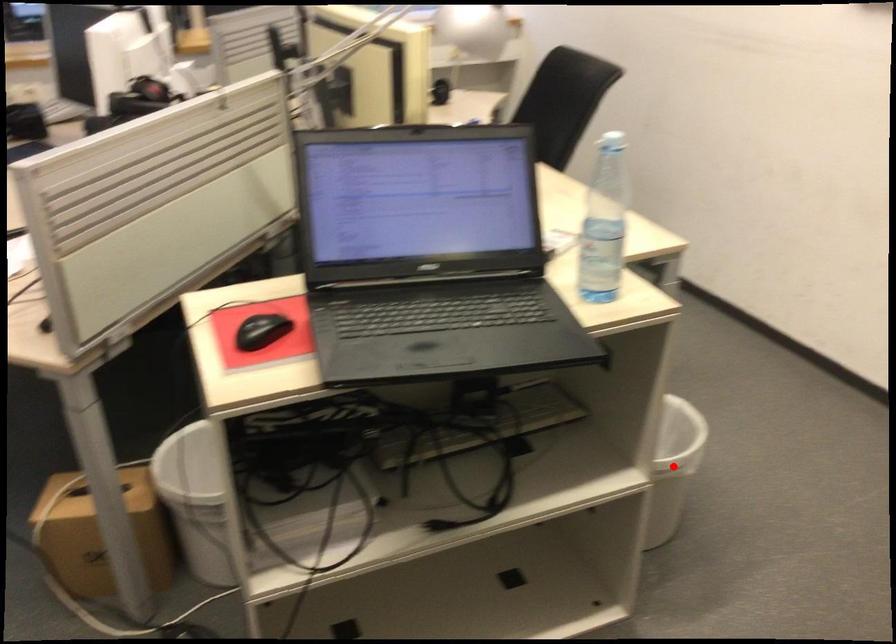
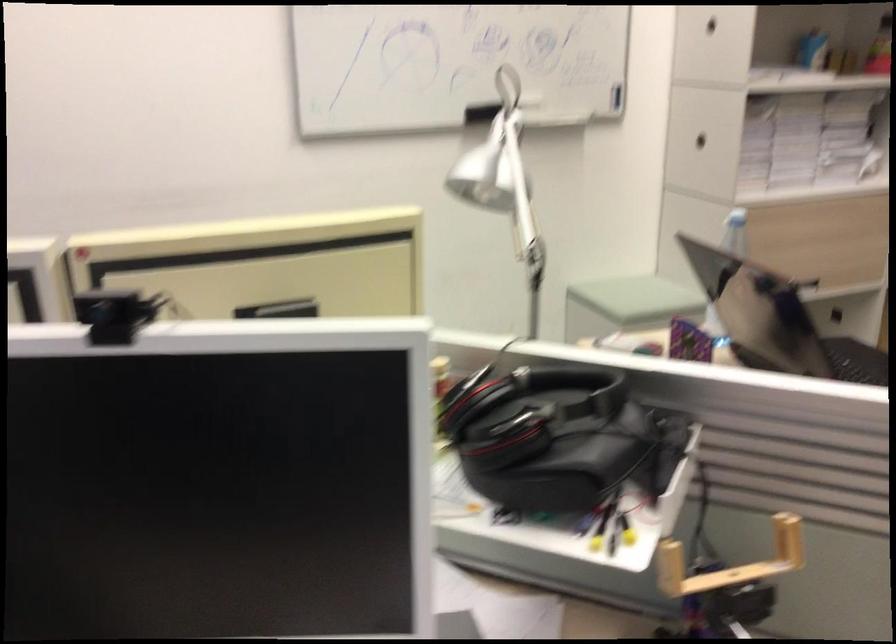
Question: I am providing you with two images of the same scene from different viewpoints. A red point is marked on the first image. Can you still see the location of the red point in image 2?

Choices:
 (A) Yes
 (B) No

Answer: (B)